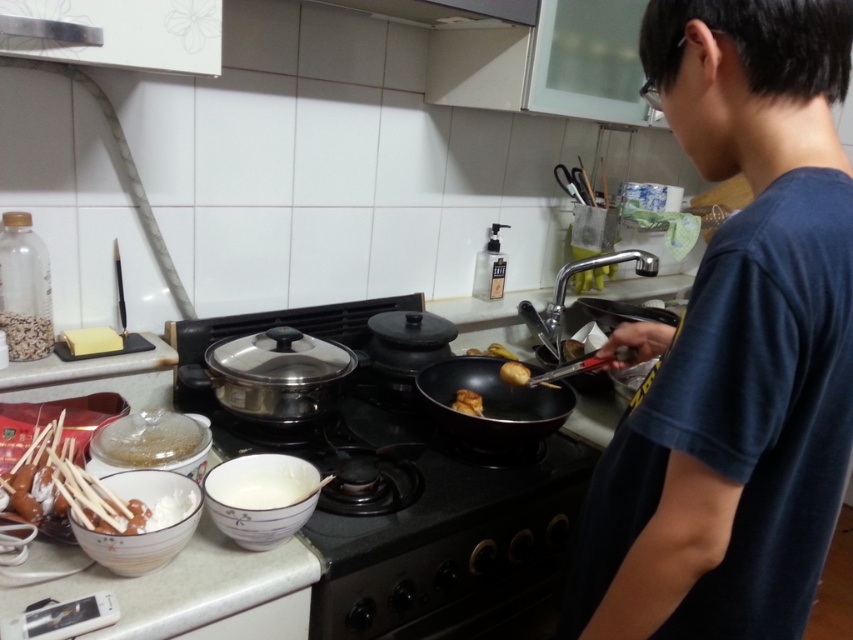
Question: Based on their relative distances, which object is farther from the dark blue t-shirt at right?

Choices:
 (A) black matte wok at center
 (B) black matte gas stove at center
 (C) golden crispy fried chicken at center
 (D) golden crispy chicken at center

Answer: (C)

Question: Can you confirm if black matte gas stove at center is bigger than golden crispy fried chicken at center?

Choices:
 (A) yes
 (B) no

Answer: (A)

Question: Which object is closer to the camera taking this photo?

Choices:
 (A) dark blue t-shirt at right
 (B) golden crispy chicken at center
 (C) black matte gas stove at center

Answer: (A)

Question: From the image, what is the correct spatial relationship of dark blue t-shirt at right in relation to golden crispy chicken at center?

Choices:
 (A) right
 (B) left

Answer: (A)

Question: Which of the following is the farthest from the observer?

Choices:
 (A) golden crispy chicken at center
 (B) black matte wok at center
 (C) golden crispy fried chicken at center

Answer: (C)

Question: Does golden crispy fried chicken at center appear on the right side of golden crispy chicken at center?

Choices:
 (A) yes
 (B) no

Answer: (B)